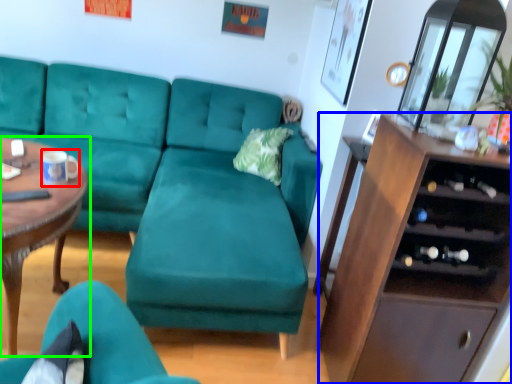
Question: Estimate the real-world distances between objects in this image. Which object is closer to coffee cup (highlighted by a red box), cabinetry (highlighted by a blue box) or coffee table (highlighted by a green box)?

Choices:
 (A) cabinetry
 (B) coffee table

Answer: (B)